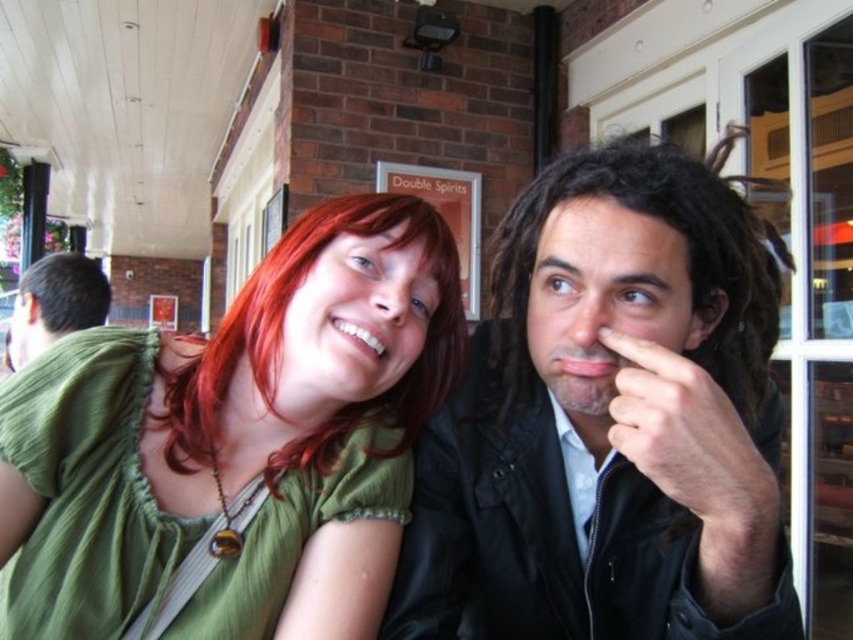
Question: Which point is farther to the camera?

Choices:
 (A) (434, 364)
 (B) (22, 304)
 (C) (740, 355)

Answer: (B)

Question: Is matte black jacket at center further to the viewer compared to green fabric shirt at left?

Choices:
 (A) yes
 (B) no

Answer: (B)

Question: Is matte black jacket at center in front of green fabric shirt at center?

Choices:
 (A) no
 (B) yes

Answer: (B)

Question: Which point appears farthest from the camera in this image?

Choices:
 (A) (376, 209)
 (B) (99, 300)
 (C) (337, 326)
 (D) (526, 336)

Answer: (B)

Question: Which object appears closest to the camera in this image?

Choices:
 (A) green fabric shirt at center
 (B) shiny red hair at center
 (C) matte black jacket at center
 (D) dark brown curly hair at right

Answer: (C)

Question: In this image, where is green fabric shirt at center located relative to dark brown curly hair at right?

Choices:
 (A) left
 (B) right

Answer: (A)